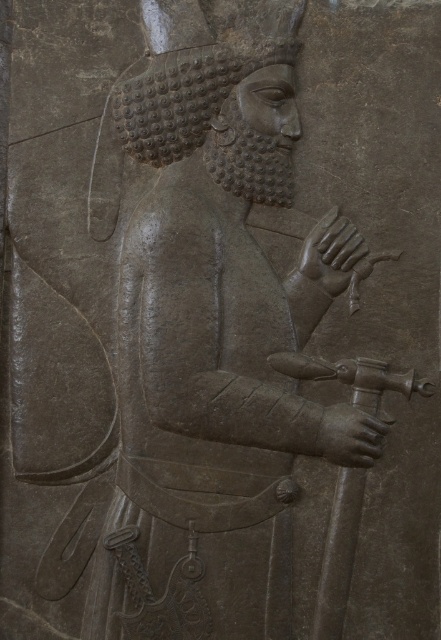
Based on the scene description, where is the smooth gray stone hand at center located in the image?

The smooth gray stone hand at center is located at point (332, 252) in the image.

You are an art conservator examining the bas relief sculpture. You need to determine the spatial relationship between the gray stone figure at center and the polished bronze hand at center. Which object is positioned higher in the artwork?

The gray stone figure at center is located above the polished bronze hand at center, so the gray stone figure at center is positioned higher in the artwork.